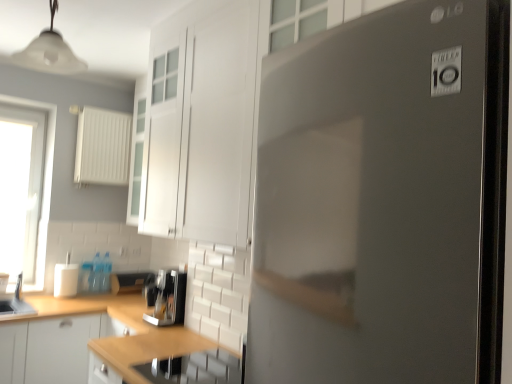
Question: In which direction should I rotate to look at white glossy cabinet at upper center, the first cabinetry viewed from the front?

Choices:
 (A) right
 (B) left

Answer: (B)

Question: Is transparent glass window at left aimed at wooden countertop at lower center?

Choices:
 (A) yes
 (B) no

Answer: (A)

Question: Is transparent glass window at left thinner than wooden countertop at lower center?

Choices:
 (A) no
 (B) yes

Answer: (B)

Question: Does transparent glass window at left have a larger size compared to wooden countertop at lower center?

Choices:
 (A) no
 (B) yes

Answer: (A)

Question: Is transparent glass window at left to the left of wooden countertop at lower center from the viewer's perspective?

Choices:
 (A) no
 (B) yes

Answer: (B)

Question: Is transparent glass window at left shorter than wooden countertop at lower center?

Choices:
 (A) no
 (B) yes

Answer: (A)

Question: Does transparent glass window at left have a smaller size compared to wooden countertop at lower center?

Choices:
 (A) yes
 (B) no

Answer: (A)

Question: Would you say white glossy cup at lower left, which is the 3th appliance from right to left, contains white matte cabinet at lower left, marked as the second cabinetry in a front-to-back arrangement?

Choices:
 (A) no
 (B) yes

Answer: (A)

Question: Does white glossy cup at lower left, which is counted as the second appliance, starting from the back, appear on the left side of white matte cabinet at lower left, the first cabinetry when ordered from left to right?

Choices:
 (A) yes
 (B) no

Answer: (A)

Question: Is white glossy cup at lower left, which ranks as the second appliance in top-to-bottom order, further to the viewer compared to white matte cabinet at lower left, the first cabinetry when ordered from left to right?

Choices:
 (A) no
 (B) yes

Answer: (B)

Question: Could you tell me if white glossy cup at lower left, which appears as the first appliance when viewed from the left, is facing white matte cabinet at lower left, the first cabinetry when ordered from left to right?

Choices:
 (A) no
 (B) yes

Answer: (A)

Question: Considering the relative sizes of white glossy cup at lower left, the second appliance positioned from the front, and white matte cabinet at lower left, which ranks as the 2th cabinetry in top-to-bottom order, in the image provided, is white glossy cup at lower left, the second appliance positioned from the front, bigger than white matte cabinet at lower left, which ranks as the 2th cabinetry in top-to-bottom order,?

Choices:
 (A) no
 (B) yes

Answer: (A)

Question: From a real-world perspective, is white glossy cup at lower left, which appears as the first appliance when viewed from the left, located beneath white matte cabinet at lower left, marked as the 2th cabinetry in a right-to-left arrangement?

Choices:
 (A) no
 (B) yes

Answer: (A)

Question: Is white glossy cup at lower left, the second appliance from the bottom, outside of white glossy cabinet at upper center, placed as the second cabinetry when sorted from left to right?

Choices:
 (A) yes
 (B) no

Answer: (A)